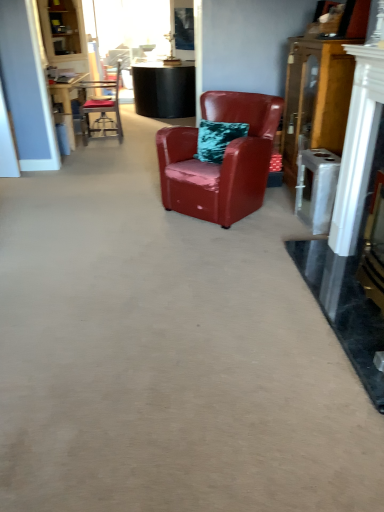
You are a GUI agent. You are given a task and a screenshot of the screen. Output one action in this format:
    pyautogui.click(x=<x>, y=<y>)
    Task: Click on the vacant space to the left of glossy leather armchair at center, positioned as the first chair in front-to-back order
    The height and width of the screenshot is (512, 384).
    Given the screenshot: What is the action you would take?
    pyautogui.click(x=127, y=213)